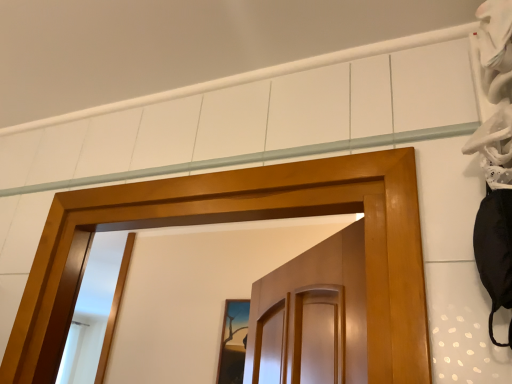
Measure the distance between point (x=500, y=305) and camera.

Point (x=500, y=305) is 24.17 inches from camera.

What are the coordinates of `black fabric bag at right` in the screenshot? It's located at (495, 251).

What do you see at coordinates (495, 251) in the screenshot? I see `black fabric bag at right` at bounding box center [495, 251].

Locate an element on the screen. The height and width of the screenshot is (384, 512). black fabric bag at right is located at coordinates click(495, 251).